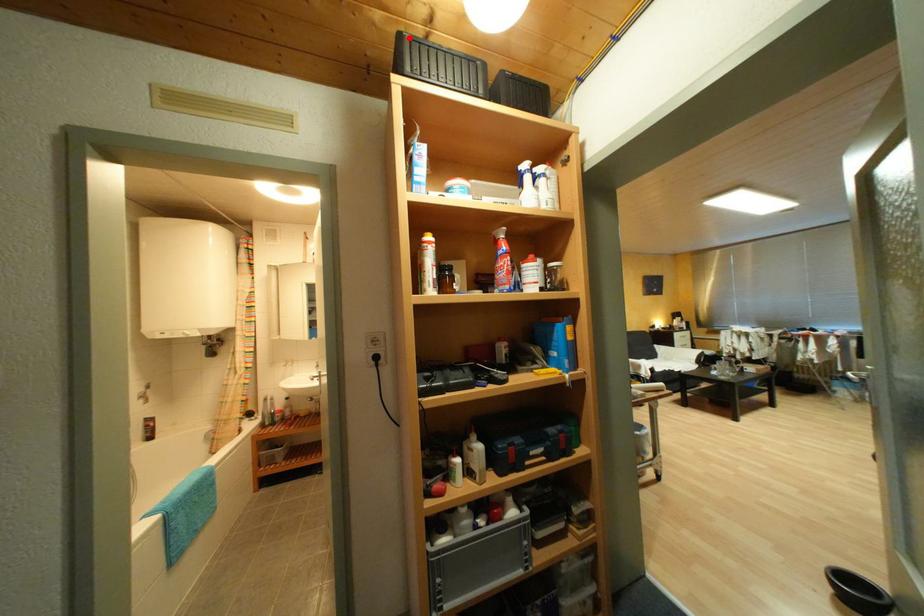
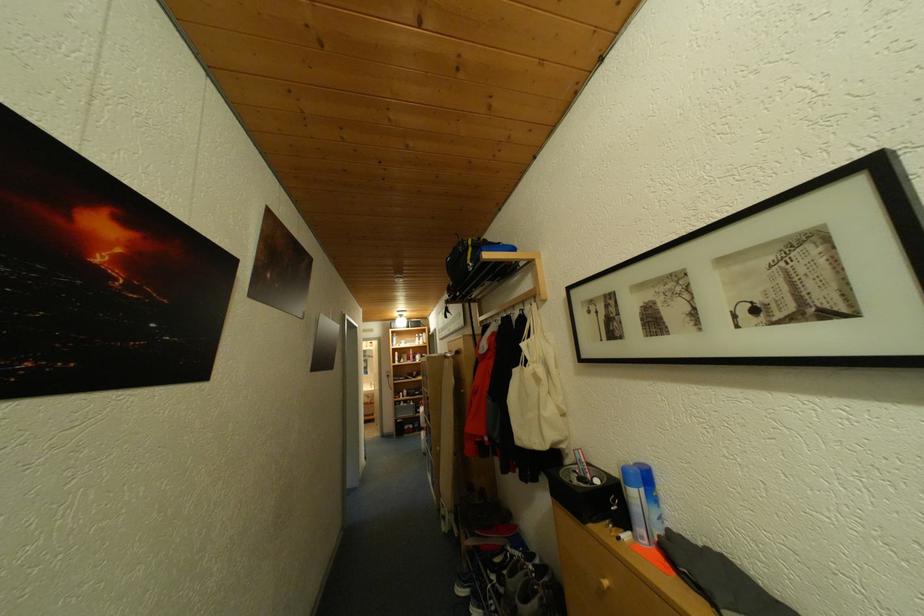
Question: I am providing you with two images of the same scene from different viewpoints. A red point is marked on the first image. Can you still see the location of the red point in image 2?

Choices:
 (A) Yes
 (B) No

Answer: (B)